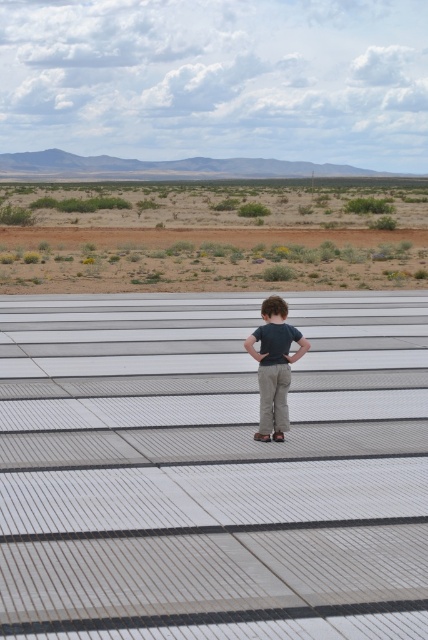
You are a photographer trying to capture the child in the scene. You want to ensure that both the desert shrubs at lower center and the matte khaki pants at center are visible in the frame. Which object should you focus on to include both in the shot?

You should focus on the desert shrubs at lower center because it is larger in size than the matte khaki pants at center, making it easier to frame both objects together.

In the scene shown: You are a photographer trying to capture a shot of the desert shrubs at lower center and the matte khaki pants at center. Since you want to focus on the shrubs, should you adjust your camera to focus on the object that is farther away or closer?

The desert shrubs at lower center are positioned over the matte khaki pants at center, meaning they are closer to the camera. To focus on the shrubs, adjust your camera to focus on the closer object.

You are a drone operator trying to capture a photo of the child from above. You have two points marked on your screen for positioning the drone. The first point is at coordinates point (x=178, y=216) and the second point is at coordinates point (x=276, y=340). Which point should you choose to ensure the drone is closer to the child?

Point (x=178, y=216) is further to the viewer than point (x=276, y=340), so choosing point (x=178, y=216) will place the drone closer to the child.